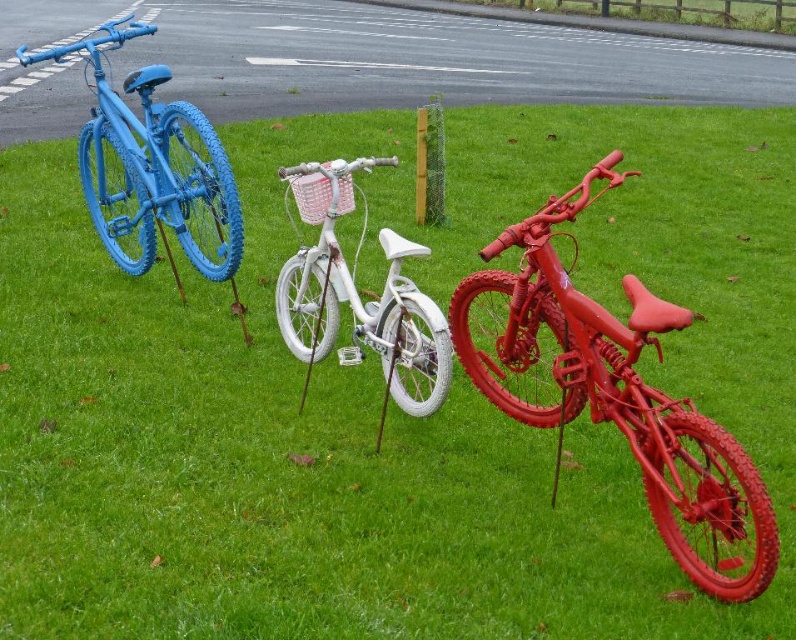
Between shiny red bicycle at right and matte blue bicycle at left, which one has more height?

shiny red bicycle at right is taller.

Locate an element on the screen. shiny red bicycle at right is located at coordinates (619, 394).

What are the coordinates of `shiny red bicycle at right` in the screenshot? It's located at (619, 394).

Between shiny red bicycle at right and white glossy bicycle at center, which one is positioned higher?

Positioned higher is white glossy bicycle at center.

Can you confirm if shiny red bicycle at right is shorter than white glossy bicycle at center?

No.

Who is more distant from viewer, (644, 320) or (276, 280)?

Positioned behind is point (276, 280).

Identify the location of shiny red bicycle at right. (619, 394).

Is matte blue bicycle at left above white glossy bicycle at center?

Yes.

The image size is (796, 640). Describe the element at coordinates (150, 164) in the screenshot. I see `matte blue bicycle at left` at that location.

Where is `matte blue bicycle at left`? This screenshot has height=640, width=796. matte blue bicycle at left is located at coordinates (150, 164).